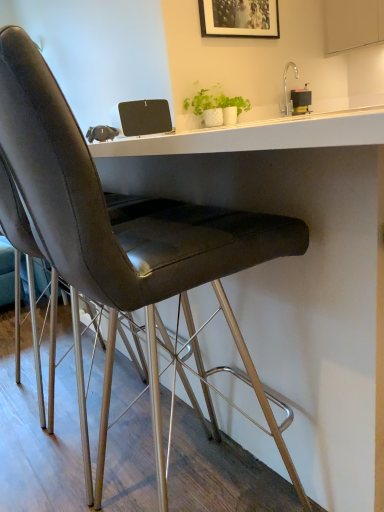
You are a GUI agent. You are given a task and a screenshot of the screen. Output one action in this format:
    pyautogui.click(x=<x>, y=<y>)
    Task: Click on the white matte cabinet at upper right
    The height and width of the screenshot is (512, 384).
    Given the screenshot: What is the action you would take?
    (x=352, y=24)

The width and height of the screenshot is (384, 512). What do you see at coordinates (352, 24) in the screenshot? I see `white matte cabinet at upper right` at bounding box center [352, 24].

Image resolution: width=384 pixels, height=512 pixels. What do you see at coordinates (239, 18) in the screenshot?
I see `wooden picture frame at upper center` at bounding box center [239, 18].

Locate an element on the screen. This screenshot has width=384, height=512. wooden picture frame at upper center is located at coordinates (239, 18).

Where is `white matte cabinet at upper right`? white matte cabinet at upper right is located at coordinates (352, 24).

Visually, is white matte cabinet at upper right positioned to the left or to the right of wooden picture frame at upper center?

Clearly, white matte cabinet at upper right is on the right of wooden picture frame at upper center in the image.

Considering the relative positions of white matte cabinet at upper right and wooden picture frame at upper center in the image provided, is white matte cabinet at upper right in front of wooden picture frame at upper center?

No, it is not.

Which point is more distant from viewer, (x=379, y=15) or (x=213, y=36)?

The point (x=379, y=15) is more distant.

From the image's perspective, would you say white matte cabinet at upper right is shown under wooden picture frame at upper center?

Incorrect, from the image's perspective, white matte cabinet at upper right is higher than wooden picture frame at upper center.

From a real-world perspective, which object stands above the other?

wooden picture frame at upper center is physically above.

Is white matte cabinet at upper right wider or thinner than wooden picture frame at upper center?

white matte cabinet at upper right is wider than wooden picture frame at upper center.

Who is shorter, white matte cabinet at upper right or wooden picture frame at upper center?

Standing shorter between the two is wooden picture frame at upper center.

Which of these two, white matte cabinet at upper right or wooden picture frame at upper center, is bigger?

Bigger between the two is white matte cabinet at upper right.

Is white matte cabinet at upper right completely or partially outside of wooden picture frame at upper center?

white matte cabinet at upper right lies outside wooden picture frame at upper center's area.

Is white matte cabinet at upper right next to wooden picture frame at upper center?

white matte cabinet at upper right is not next to wooden picture frame at upper center, and they're not touching.

Is white matte cabinet at upper right oriented away from wooden picture frame at upper center?

white matte cabinet at upper right is not turned away from wooden picture frame at upper center.

In the scene shown: Can you tell me how much white matte cabinet at upper right and wooden picture frame at upper center differ in facing direction?

They differ by 89.4 degrees in their facing directions.

How distant is white matte cabinet at upper right from wooden picture frame at upper center?

The distance of white matte cabinet at upper right from wooden picture frame at upper center is 29.02 inches.

At what (x,y) coordinates should I click in order to perform the action: click on picture frame located below the white matte cabinet at upper right (from the image's perspective). Please return your answer as a coordinate pair (x, y). Looking at the image, I should click on (239, 18).

Visually, is wooden picture frame at upper center positioned to the left or to the right of white matte cabinet at upper right?

wooden picture frame at upper center is to the left of white matte cabinet at upper right.

Considering their positions, is wooden picture frame at upper center located in front of or behind white matte cabinet at upper right?

wooden picture frame at upper center is in front of white matte cabinet at upper right.

Which is in front, point (224, 14) or point (358, 1)?

Point (224, 14)

From the image's perspective, is wooden picture frame at upper center located beneath white matte cabinet at upper right?

Yes, from the image's perspective, wooden picture frame at upper center is below white matte cabinet at upper right.

From a real-world perspective, is wooden picture frame at upper center under white matte cabinet at upper right?

No.

Can you confirm if wooden picture frame at upper center is wider than white matte cabinet at upper right?

No.

Considering the relative sizes of wooden picture frame at upper center and white matte cabinet at upper right in the image provided, is wooden picture frame at upper center shorter than white matte cabinet at upper right?

Yes, wooden picture frame at upper center is shorter than white matte cabinet at upper right.

From the picture: Considering the relative sizes of wooden picture frame at upper center and white matte cabinet at upper right in the image provided, is wooden picture frame at upper center smaller than white matte cabinet at upper right?

Indeed, wooden picture frame at upper center has a smaller size compared to white matte cabinet at upper right.

Is wooden picture frame at upper center outside of white matte cabinet at upper right?

Yes, wooden picture frame at upper center is outside of white matte cabinet at upper right.

Consider the image. Is wooden picture frame at upper center far from white matte cabinet at upper right?

No, wooden picture frame at upper center is in close proximity to white matte cabinet at upper right.

Looking at this image, does wooden picture frame at upper center turn towards white matte cabinet at upper right?

No, wooden picture frame at upper center is not aimed at white matte cabinet at upper right.

Can you tell me how much wooden picture frame at upper center and white matte cabinet at upper right differ in facing direction?

The facing directions of wooden picture frame at upper center and white matte cabinet at upper right are 89.4 degrees apart.

I want to click on picture frame on the left of white matte cabinet at upper right, so click(x=239, y=18).

Find the location of a particular element. The image size is (384, 512). cabinetry lying behind the wooden picture frame at upper center is located at coordinates (352, 24).

The width and height of the screenshot is (384, 512). In order to click on cabinetry on the right of wooden picture frame at upper center in this screenshot , I will do `click(352, 24)`.